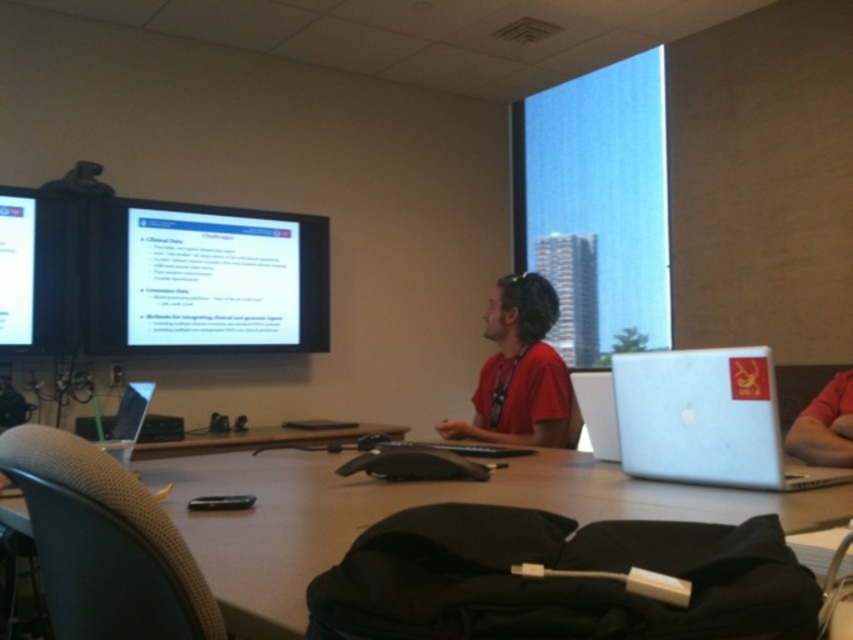
You are an attendee at a conference and need to present your slides. You see a matte black screen at upper left and a silver metallic laptop at right. Which device should you connect your presentation to, and why?

You should connect your presentation to the matte black screen at upper left because it is taller than the silver metallic laptop at right, making it more likely to be the presentation screen.

You are a security guard in the conference room and need to retrieve the silver metallic laptop at right from the table. The nearest chair is 1.43 meters away from the laptop. Can you safely walk from the chair to the laptop without moving any other items?

The silver metallic laptop at right is 1.43 meters away from the nearest chair. Since the distance is sufficient, you can safely walk from the chair to the laptop without moving other items.